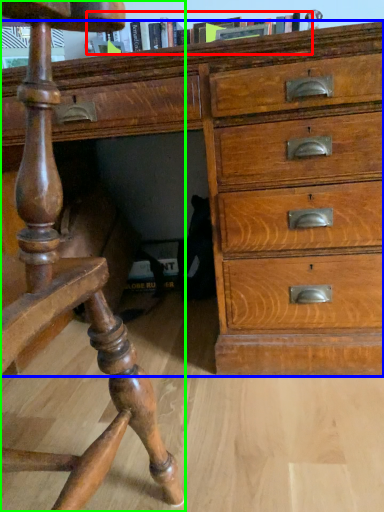
Question: Considering the real-world distances, which object is farthest from book (highlighted by a red box)? chest of drawers (highlighted by a blue box) or furniture (highlighted by a green box)?

Choices:
 (A) chest of drawers
 (B) furniture

Answer: (B)